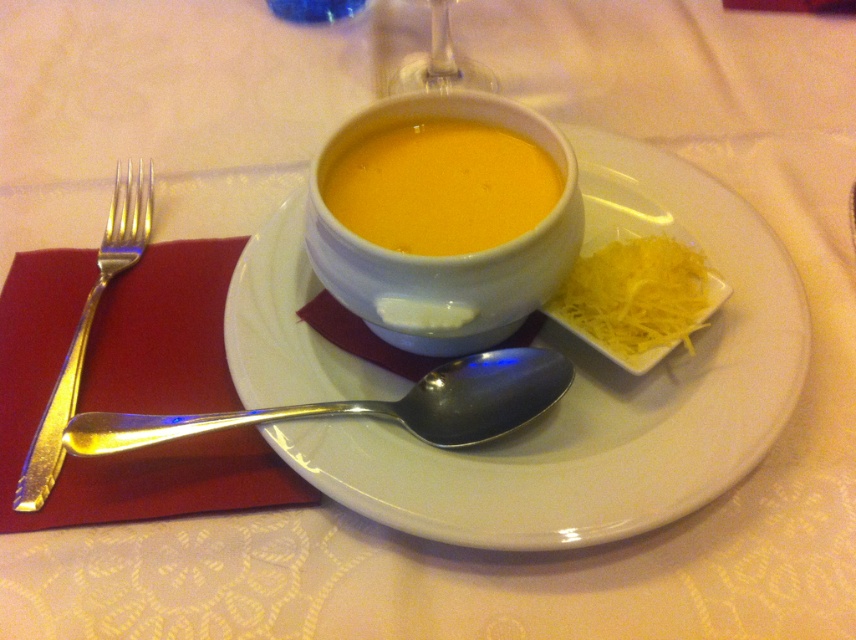
Can you confirm if white glossy bowl at center is positioned below yellow shredded cheese at right?

Actually, white glossy bowl at center is above yellow shredded cheese at right.

At what (x,y) coordinates should I click in order to perform the action: click on white glossy bowl at center. Please return your answer as a coordinate pair (x, y). Looking at the image, I should click on (446, 257).

Between yellow matte soup at center and silver metallic fork at left, which one appears on the left side from the viewer's perspective?

Positioned to the left is silver metallic fork at left.

Consider the image. Can you confirm if yellow matte soup at center is positioned to the left of silver metallic fork at left?

In fact, yellow matte soup at center is to the right of silver metallic fork at left.

Between point (443, 225) and point (40, 432), which one is positioned behind?

The point (40, 432) is behind.

You are a GUI agent. You are given a task and a screenshot of the screen. Output one action in this format:
    pyautogui.click(x=<x>, y=<y>)
    Task: Click on the yellow matte soup at center
    This screenshot has height=640, width=856.
    Given the screenshot: What is the action you would take?
    pyautogui.click(x=438, y=186)

Does white glossy plate at center appear over silver metallic fork at left?

Incorrect, white glossy plate at center is not positioned above silver metallic fork at left.

Which is more to the right, white glossy plate at center or silver metallic fork at left?

white glossy plate at center is more to the right.

Find the location of a particular element. white glossy plate at center is located at coordinates (601, 394).

You are a GUI agent. You are given a task and a screenshot of the screen. Output one action in this format:
    pyautogui.click(x=<x>, y=<y>)
    Task: Click on the white glossy plate at center
    
    Given the screenshot: What is the action you would take?
    pyautogui.click(x=601, y=394)